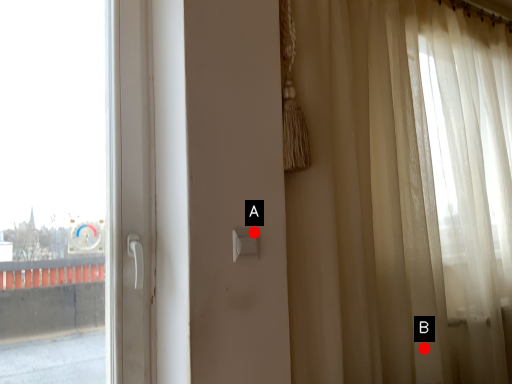
Question: Two points are circled on the image, labeled by A and B beside each circle. Which point appears closest to the camera in this image?

Choices:
 (A) A is closer
 (B) B is closer

Answer: (A)